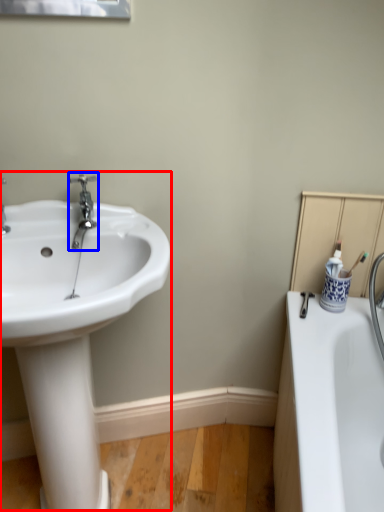
Question: Which point is closer to the camera, sink (highlighted by a red box) or tap (highlighted by a blue box)?

Choices:
 (A) sink
 (B) tap

Answer: (A)